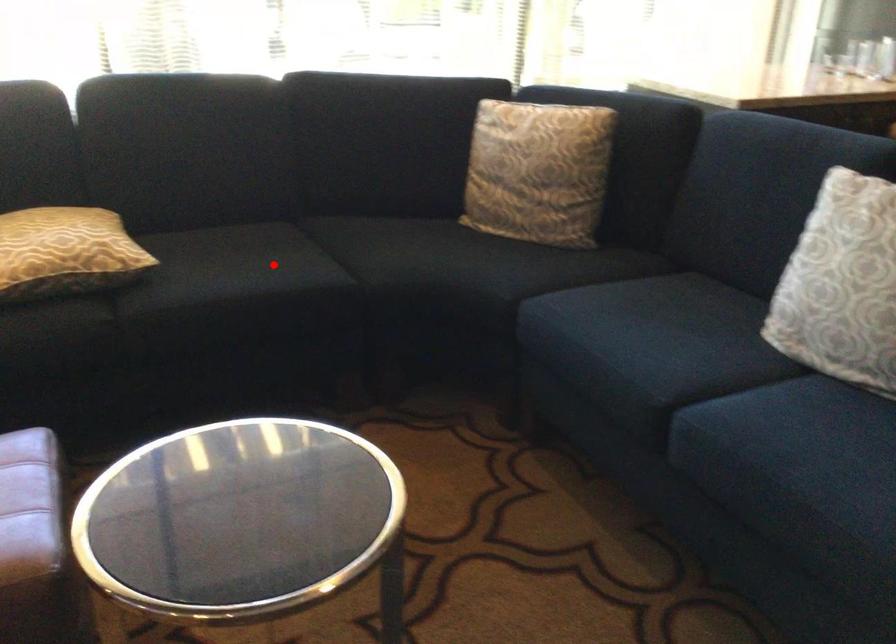
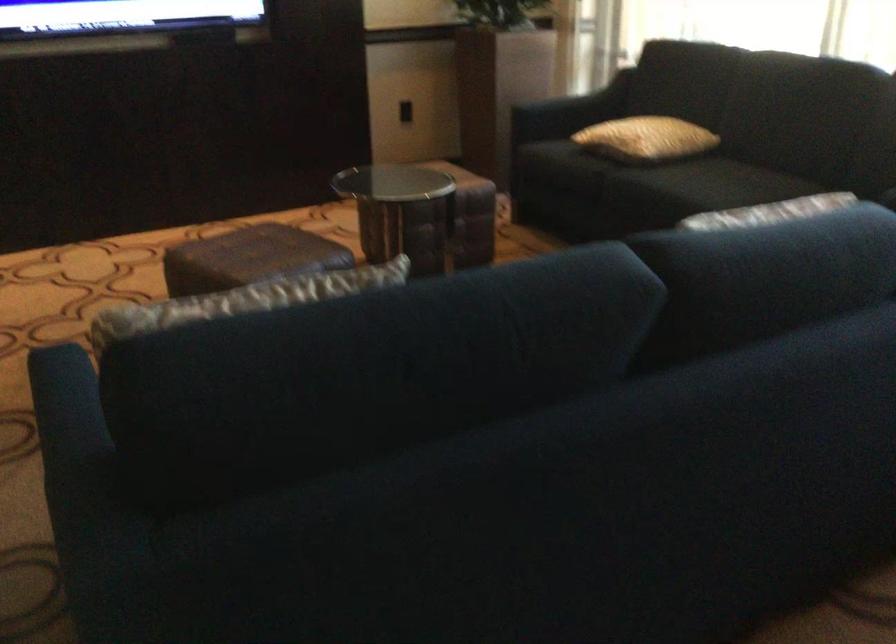
Where in the second image is the point corresponding to the highlighted location from the first image?

(709, 184)